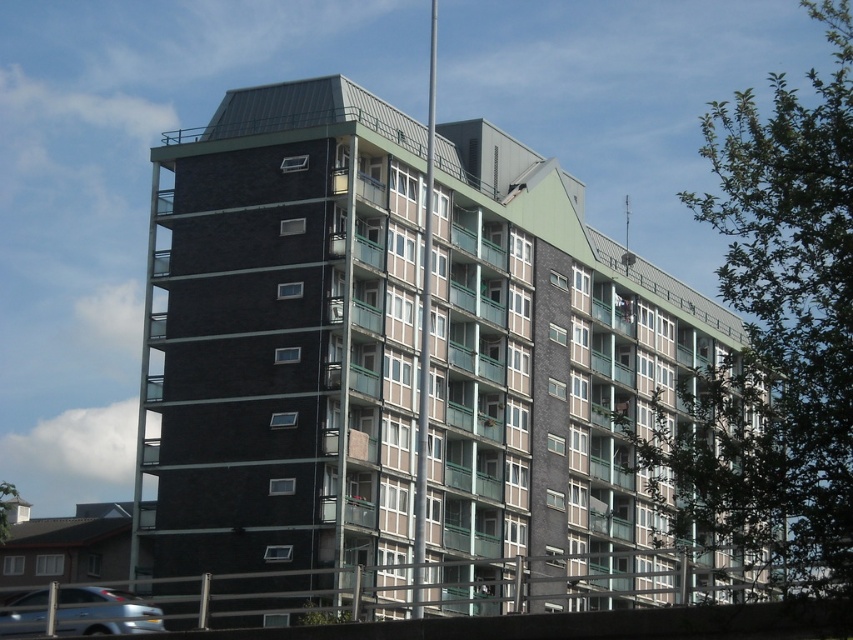
In the image of the residential building, there is a point labeled as point (775, 339). What does this point represent?

The point (775, 339) represents the location of the green leafy tree at upper right.

You are standing on a balcony of the residential building and want to plant a new tree. The green leafy tree at upper right is already present. Where should you place the new tree so it doesn not block the view of the silver metallic car at lower left?

The green leafy tree at upper right is located above the silver metallic car at lower left, so placing the new tree below the existing tree would keep it from blocking the view of the silver metallic car at lower left.

You are a photographer planning to capture the dark gray concrete building at center and the green leafy tree at upper right in a single shot. Based on their sizes in the image, which object would you need to frame more carefully to ensure it doesn t get cropped out?

The green leafy tree at upper right occupies more space in the image than the dark gray concrete building at center, so you should frame the larger tree to ensure it fits within the shot.